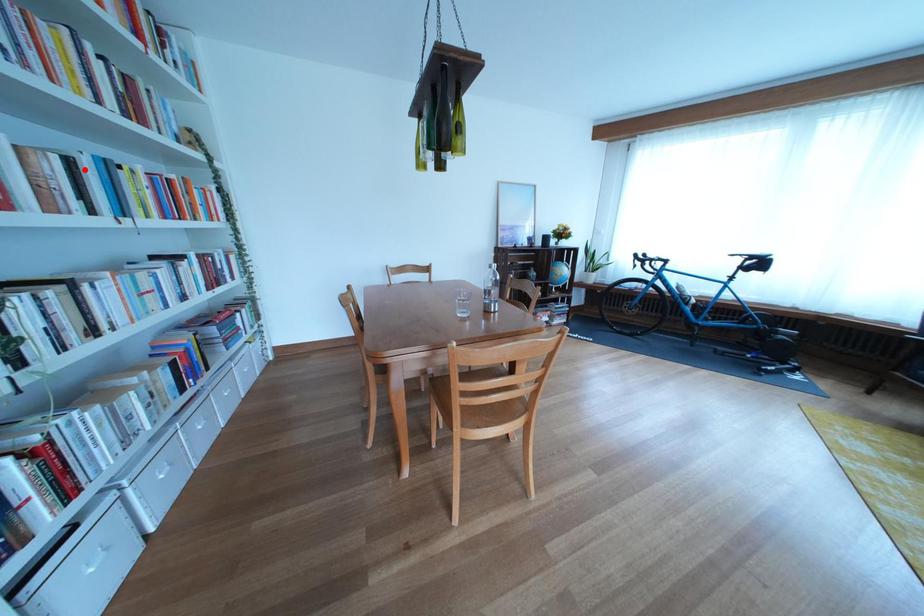
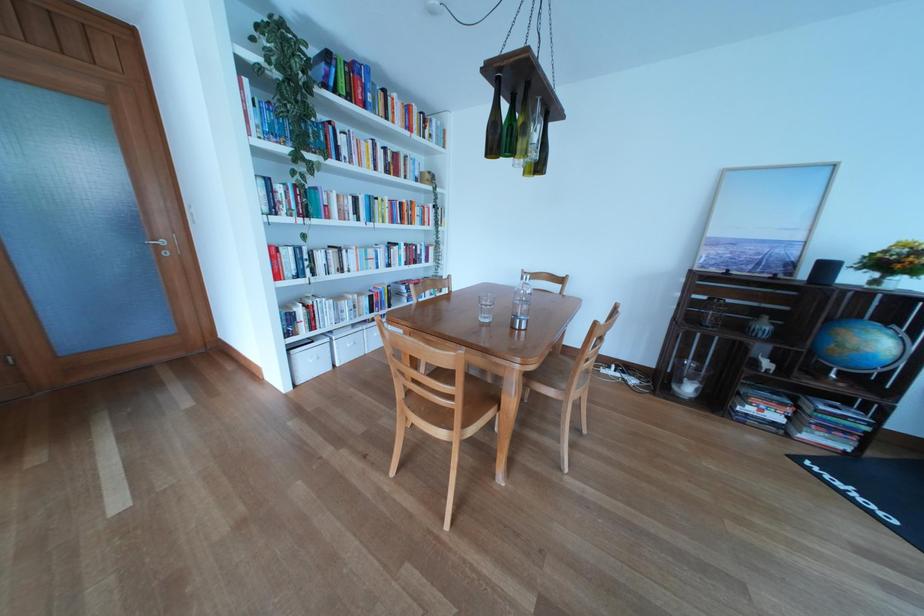
Question: I am providing you with two images of the same scene from different viewpoints. A red point is shown in image1. For the corresponding object point in image2, is it positioned nearer or farther from the camera?

Choices:
 (A) Nearer
 (B) Farther

Answer: (A)